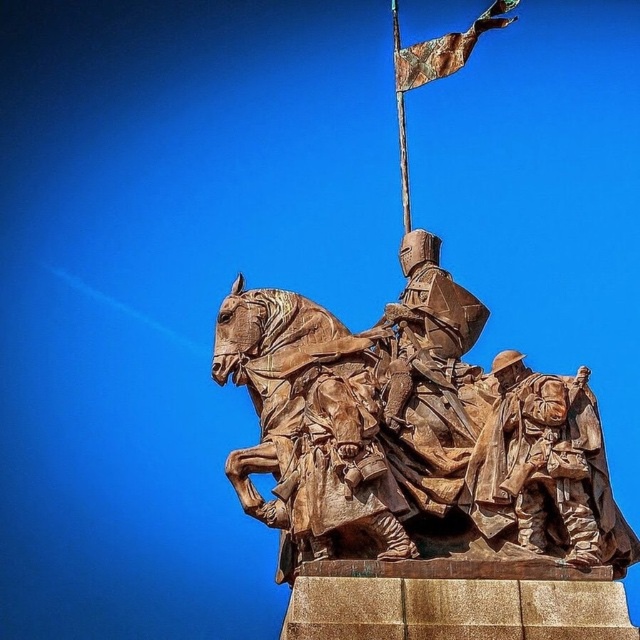
Who is taller, rustic bronze horse at center or rusty metal flag at upper center?

rusty metal flag at upper center is taller.

Between point (250, 449) and point (467, 40), which one is positioned behind?

The point (250, 449) is behind.

Between point (365, 488) and point (467, 42), which one is positioned in front?

Point (365, 488)

At what (x,y) coordinates should I click in order to perform the action: click on rustic bronze horse at center. Please return your answer as a coordinate pair (x, y). Image resolution: width=640 pixels, height=640 pixels. Looking at the image, I should click on (308, 426).

Can you confirm if bronze statue at center is positioned to the left of rustic bronze horse at center?

Incorrect, bronze statue at center is not on the left side of rustic bronze horse at center.

Is the position of bronze statue at center less distant than that of rustic bronze horse at center?

Yes.

Between point (429, 372) and point (307, 509), which one is positioned behind?

The point (429, 372) is more distant.

This screenshot has width=640, height=640. Find the location of `bronze statue at center`. bronze statue at center is located at coordinates (413, 433).

Can you confirm if bronze statue at center is positioned to the right of rustic bronze soldiers at lower right?

No, bronze statue at center is not to the right of rustic bronze soldiers at lower right.

This screenshot has height=640, width=640. I want to click on bronze statue at center, so click(x=413, y=433).

Locate an element on the screen. The height and width of the screenshot is (640, 640). bronze statue at center is located at coordinates (413, 433).